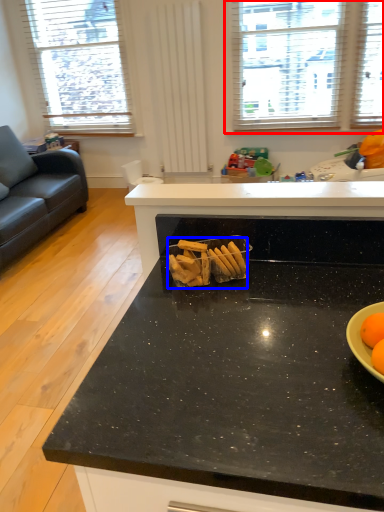
Question: Which point is further to the camera, window (highlighted by a red box) or snack (highlighted by a blue box)?

Choices:
 (A) window
 (B) snack

Answer: (A)